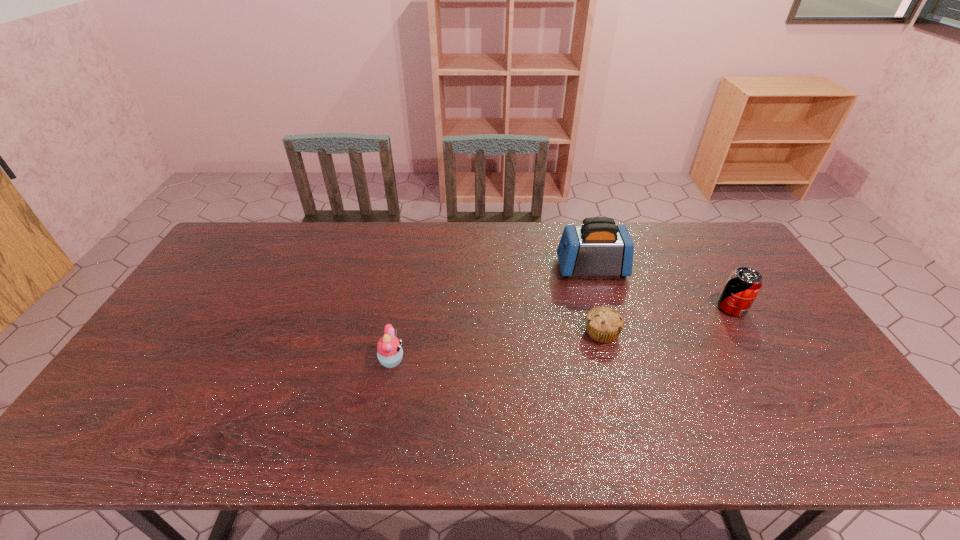
Where is `the tallest object`? This screenshot has width=960, height=540. the tallest object is located at coordinates (598, 247).

Where is `the farthest object`? The image size is (960, 540). the farthest object is located at coordinates (598, 247).

This screenshot has height=540, width=960. I want to click on the rightmost object, so click(743, 285).

The height and width of the screenshot is (540, 960). Find the location of `the second tallest object`. the second tallest object is located at coordinates (743, 285).

Identify the location of cupcake. This screenshot has width=960, height=540. (389, 351).

You are a GUI agent. You are given a task and a screenshot of the screen. Output one action in this format:
    pyautogui.click(x=<x>, y=<y>)
    Task: Click on the leftmost object
    The image size is (960, 540).
    Given the screenshot: What is the action you would take?
    pyautogui.click(x=389, y=351)

In order to click on the shortest object in this screenshot , I will do `click(603, 324)`.

You are a GUI agent. You are given a task and a screenshot of the screen. Output one action in this format:
    pyautogui.click(x=<x>, y=<y>)
    Task: Click on the free space located on the front-facing side of the toaster
    Image resolution: width=960 pixels, height=540 pixels.
    Given the screenshot: What is the action you would take?
    pyautogui.click(x=482, y=268)

The height and width of the screenshot is (540, 960). Identify the location of vacant space located 0.310m on the front-facing side of the toaster. (464, 268).

Locate an element on the screen. The height and width of the screenshot is (540, 960). vacant position located 0.330m on the front-facing side of the toaster is located at coordinates (458, 268).